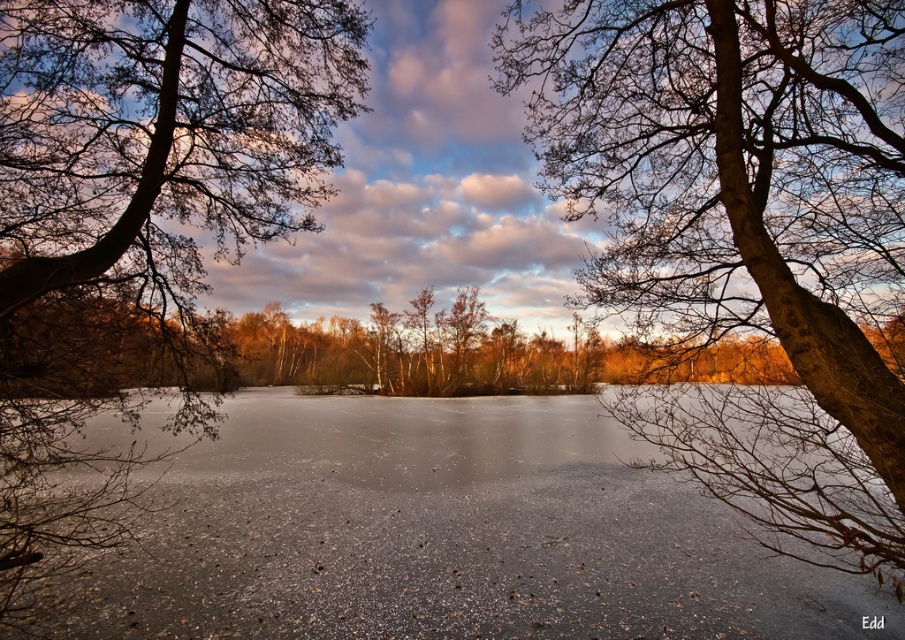
Question: Which point is closer to the camera?

Choices:
 (A) (682, 116)
 (B) (34, 480)

Answer: (A)

Question: Which object is farther from the camera taking this photo?

Choices:
 (A) brown rough bark tree at left
 (B) brown rough bark tree at upper right

Answer: (B)

Question: Observing the image, what is the correct spatial positioning of brown rough bark tree at upper right in reference to brown rough bark tree at left?

Choices:
 (A) below
 (B) above

Answer: (A)

Question: Among these points, which one is nearest to the camera?

Choices:
 (A) (902, 328)
 (B) (214, 22)

Answer: (A)

Question: Can you confirm if brown rough bark tree at upper right is thinner than brown rough bark tree at left?

Choices:
 (A) yes
 (B) no

Answer: (A)

Question: Can you confirm if brown rough bark tree at upper right is wider than brown rough bark tree at left?

Choices:
 (A) no
 (B) yes

Answer: (A)